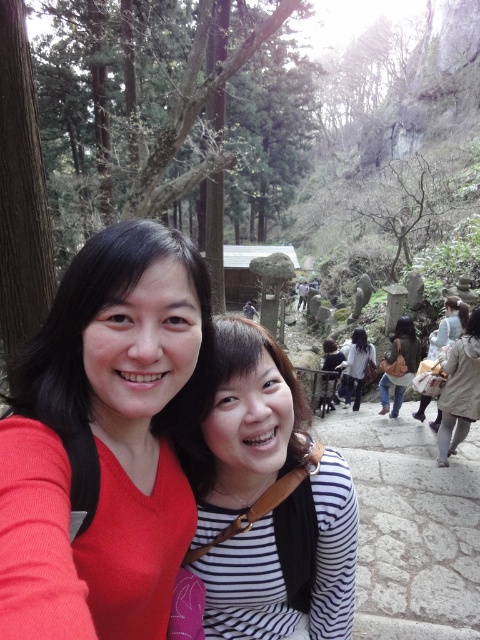
You are a photographer taking a picture of two people wearing light beige coat at right and white cotton shirt at center. Which clothing item is located to the right of the other?

The light beige coat at right is positioned on the right side of white cotton shirt at center.

You are standing at the viewpoint looking at the striped fabric shirt at center and the gray stone steps at lower right. Which object is nearer to you?

The striped fabric shirt at center is closer to the viewer than the gray stone steps at lower right.